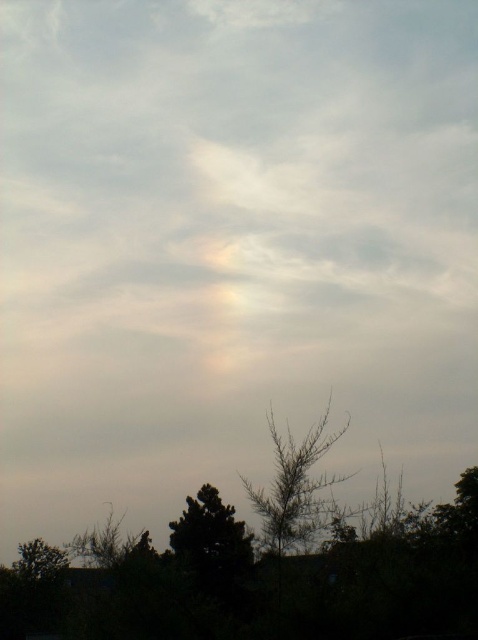
Does point (272, 506) lie behind point (26, 545)?

No, (272, 506) is closer to viewer.

Does green leafy tree at center have a lesser width compared to green matte tree at lower left?

Indeed, green leafy tree at center has a lesser width compared to green matte tree at lower left.

Who is more forward, (x=300, y=538) or (x=13, y=564)?

Point (x=300, y=538) is more forward.

Where is `green leafy tree at center`? green leafy tree at center is located at coordinates (296, 490).

What do you see at coordinates (296, 490) in the screenshot? I see `green leafy tree at center` at bounding box center [296, 490].

Can you confirm if green leafy tree at center is smaller than green matte tree at lower center?

Correct, green leafy tree at center occupies less space than green matte tree at lower center.

Is point (301, 451) farther from viewer compared to point (223, 579)?

No.

Find the location of `green leafy tree at center`. green leafy tree at center is located at coordinates (296, 490).

Is green matte tree at lower center closer to camera compared to green matte tree at lower left?

Yes, it is.

Who is more forward, (180, 516) or (14, 566)?

Positioned in front is point (180, 516).

The height and width of the screenshot is (640, 478). I want to click on green matte tree at lower center, so click(x=210, y=538).